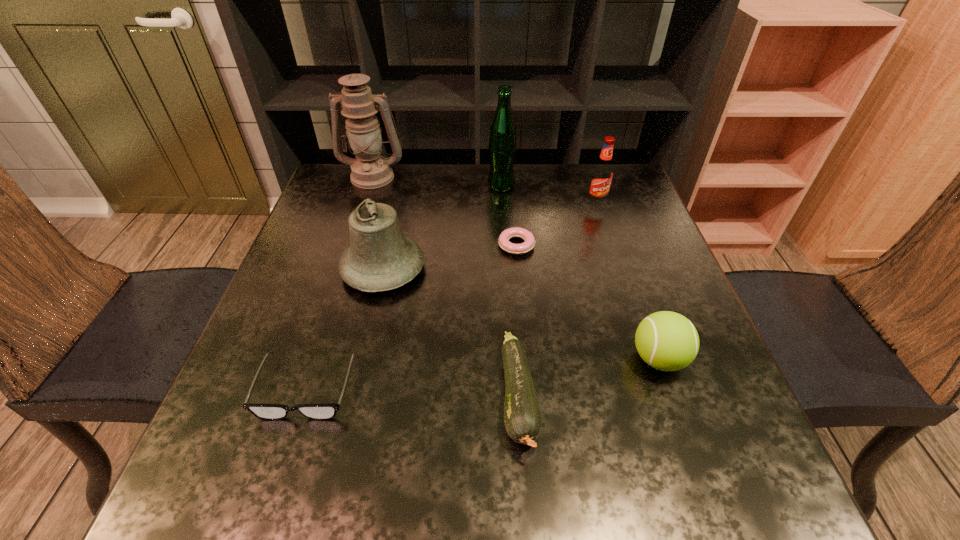
Where is `oil lamp that is at the left edge`? oil lamp that is at the left edge is located at coordinates (370, 170).

You are a GUI agent. You are given a task and a screenshot of the screen. Output one action in this format:
    pyautogui.click(x=<x>, y=<y>)
    Task: Click on the bell located at the left edge
    
    Given the screenshot: What is the action you would take?
    pyautogui.click(x=380, y=258)

This screenshot has width=960, height=540. In order to click on spectacles located in the left edge section of the desktop in this screenshot , I will do `click(327, 411)`.

Find the location of a particular element. root beer positioned at the right edge is located at coordinates (602, 173).

The width and height of the screenshot is (960, 540). I want to click on tennis ball positioned at the right edge, so click(668, 341).

Identify the location of object at the far left corner. The image size is (960, 540). (370, 170).

Where is `object present at the far right corner`? Image resolution: width=960 pixels, height=540 pixels. object present at the far right corner is located at coordinates (602, 173).

I want to click on vacant area at the far edge, so click(x=549, y=170).

Identify the location of free point at the near edge. (636, 480).

At what (x,y) coordinates should I click in order to perform the action: click on vacant space at the left edge of the desktop. Please return your answer as a coordinate pair (x, y). The width and height of the screenshot is (960, 540). Looking at the image, I should click on (310, 234).